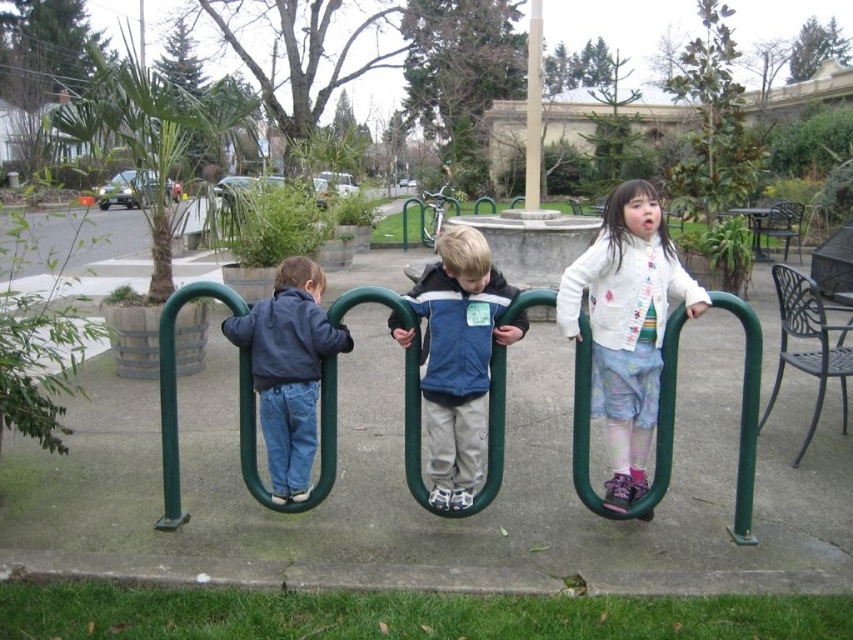
You are a parent supervising children playing on the green plastic playground equipment at center. You notice a smooth beige pole at center nearby. From your position, which object is closer to you?

The green plastic playground equipment at center is closer to you because it is in front of the smooth beige pole at center.